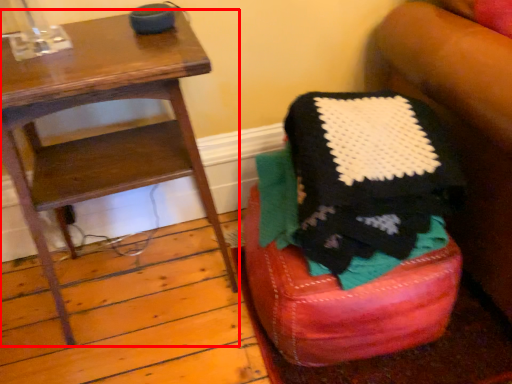
Question: Considering the relative positions of furniture (annotated by the red box) and bar stool in the image provided, where is furniture (annotated by the red box) located with respect to the staircase?

Choices:
 (A) left
 (B) right

Answer: (A)